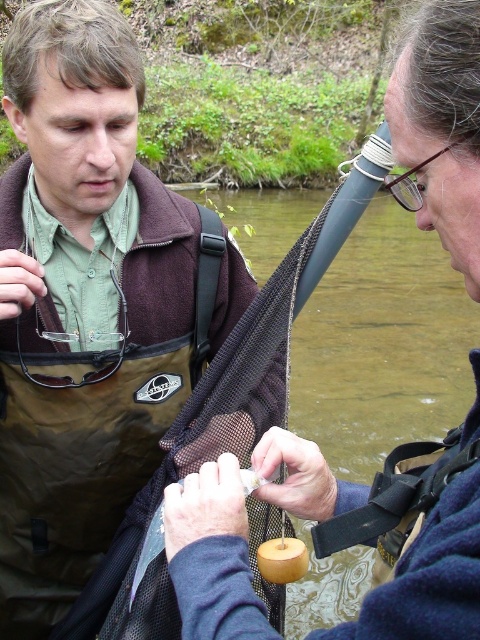
You are a photographer positioned behind the two people in the scene. You want to capture a clear photo of the matte black vest at center and the matte black vest at left without any obstruction. Which person should you focus on first to ensure they are in the frame and not blocked by the other?

You should focus on the matte black vest at left first because it is behind the matte black vest at center, so adjusting the camera angle to include both would require ensuring the matte black vest at left is positioned where it won not be obscured by the matte black vest at center.

Based on the photo, you are standing at the back of the image and want to hand a tool to both the matte black vest at center and the matte black vest at left. Which person would you need to reach higher to give the tool to?

The matte black vest at center is much taller than the matte black vest at left, so you would need to reach higher to give the tool to the matte black vest at center.